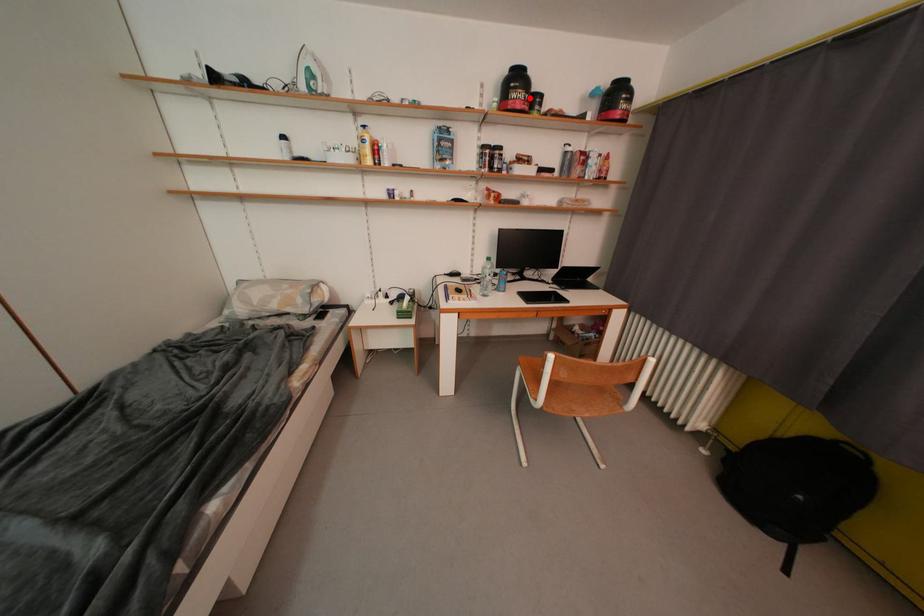
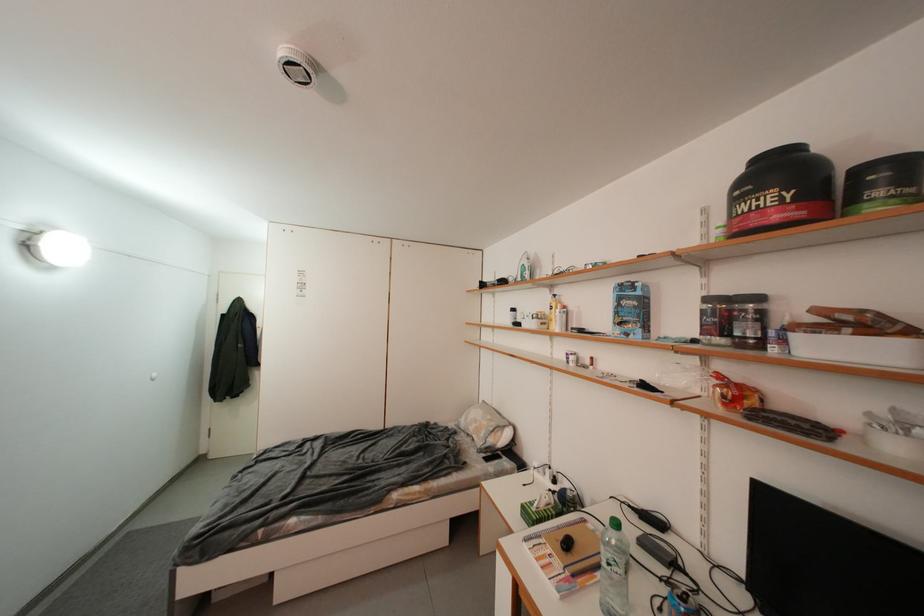
Find the pixel in the second image that matches the highlighted location in the first image.

(776, 201)